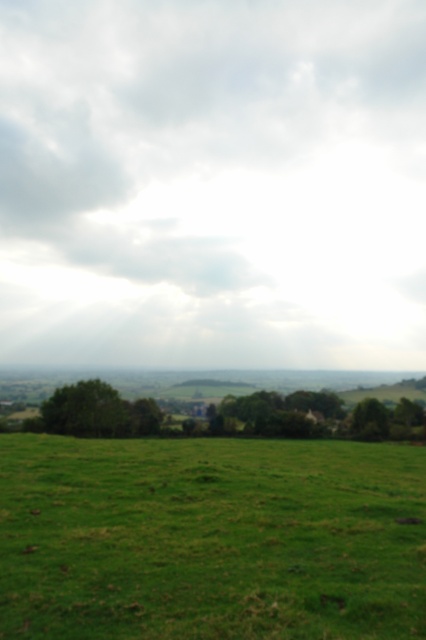
Can you confirm if white fluffy cloud at upper center is wider than green grass at lower center?

Correct, the width of white fluffy cloud at upper center exceeds that of green grass at lower center.

Does white fluffy cloud at upper center lie in front of green grass at lower center?

No.

This screenshot has width=426, height=640. What do you see at coordinates (213, 182) in the screenshot? I see `white fluffy cloud at upper center` at bounding box center [213, 182].

Where is `white fluffy cloud at upper center`? white fluffy cloud at upper center is located at coordinates (213, 182).